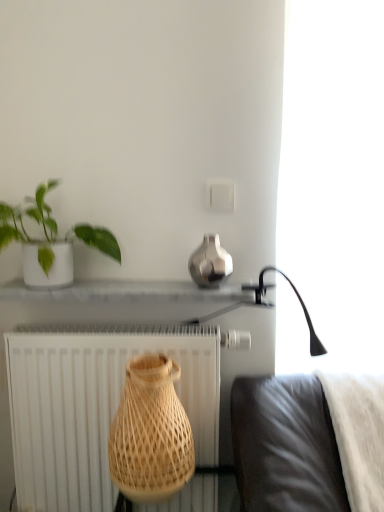
Question: Is point (89, 438) closer or farther from the camera than point (185, 458)?

Choices:
 (A) farther
 (B) closer

Answer: (A)

Question: Would you say white textured radiator at lower left is to the left or to the right of natural wood vase at center, which is the first vase in bottom-to-top order, in the picture?

Choices:
 (A) left
 (B) right

Answer: (A)

Question: Estimate the real-world distances between objects in this image. Which object is closer to the green matte plant at upper left?

Choices:
 (A) natural wood vase at center, placed as the second vase when sorted from right to left
 (B) white textured radiator at lower left
 (C) shiny metallic vase at center, positioned as the 2th vase in left-to-right order
 (D) white fluffy blanket at lower right
 (E) white glossy shelf at center

Answer: (E)

Question: Based on their relative distances, which object is farther from the shiny metallic vase at center, positioned as the 2th vase in left-to-right order?

Choices:
 (A) natural wood vase at center, which is the first vase in bottom-to-top order
 (B) white textured radiator at lower left
 (C) green matte plant at upper left
 (D) white glossy shelf at center
 (E) white fluffy blanket at lower right

Answer: (E)